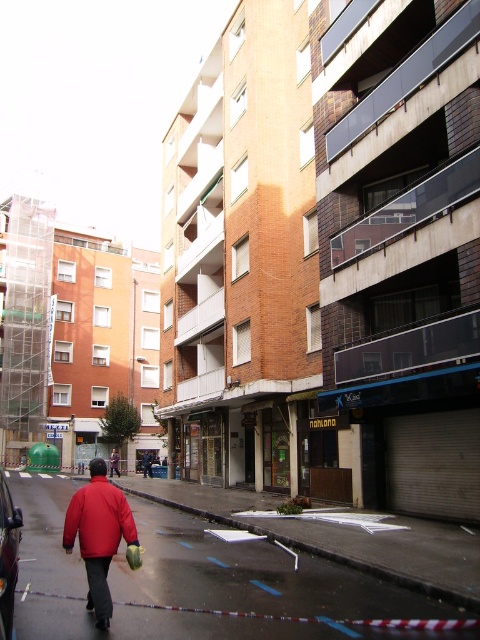
You are standing at the corner of the street and want to walk to the concrete pavement at center. What coordinates should you head towards?

You should head towards the coordinates point (253, 589) as that is where the concrete pavement at center is located.

You are a delivery person standing at the edge of the street looking towards the buildings. You need to place a package on the concrete pavement at center. To do so, you must walk past the red fabric jacket at lower left. Will you need to walk to the right of the jacket to reach the pavement?

Yes, since the concrete pavement at center is to the right of the red fabric jacket at lower left, you will need to walk to the right of the jacket to reach it.

You are a pedestrian standing on the concrete pavement at center. You want to walk to the shiny black car at lower left. Is the car parked in front of you or behind you?

The concrete pavement at center is below shiny black car at lower left, so the car is parked in front of you.